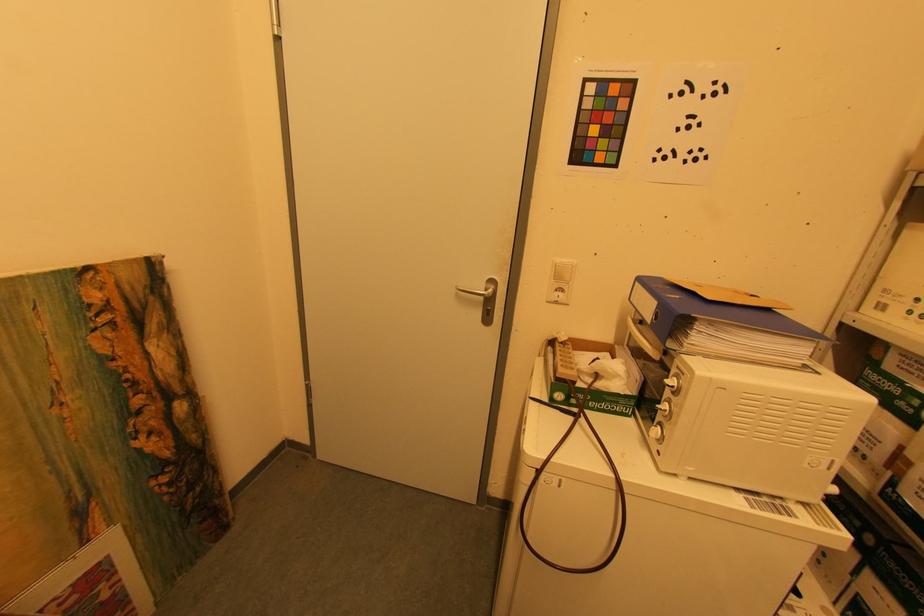
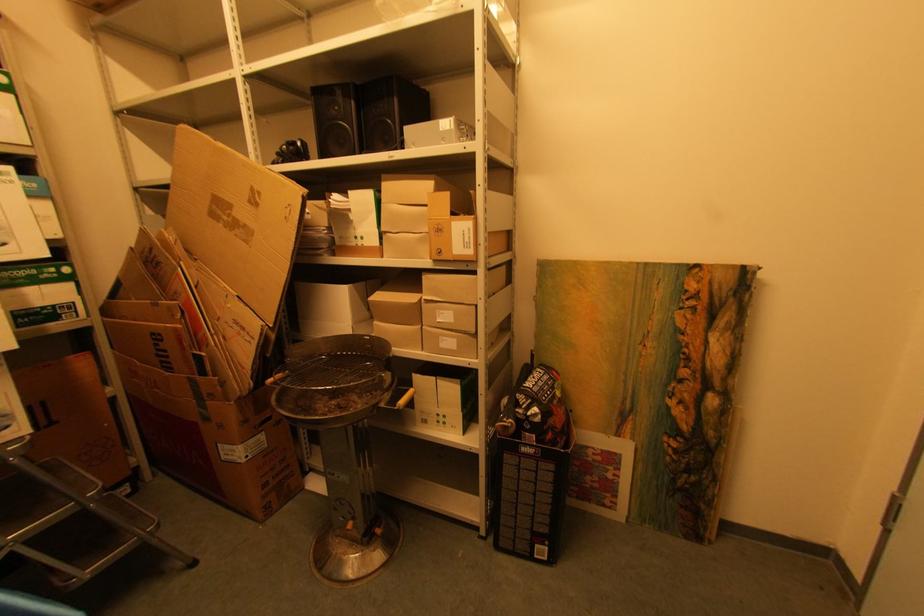
Question: How did the camera likely rotate?

Choices:
 (A) Left
 (B) Right
 (C) Up
 (D) Down

Answer: (A)